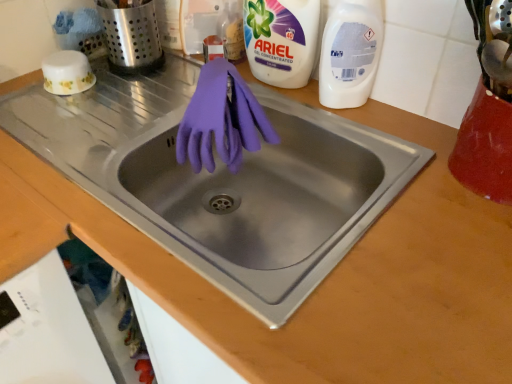
Locate an element on the screen. The height and width of the screenshot is (384, 512). free spot above matte purple gloves at center (from a real-world perspective) is located at coordinates 154,111.